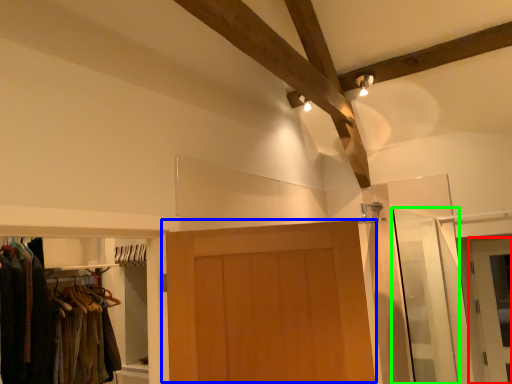
Question: Which is nearer to the door (highlighted by a red box)? door (highlighted by a blue box) or screen door (highlighted by a green box).

Choices:
 (A) door
 (B) screen door

Answer: (B)